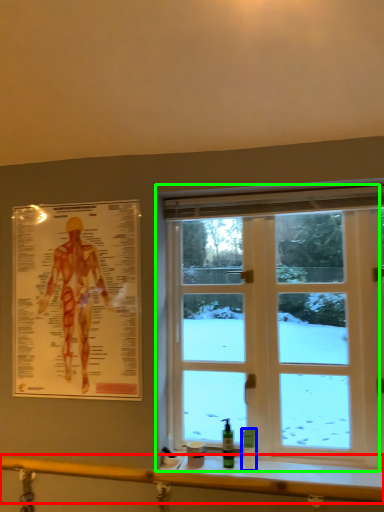
Question: Which is nearer to the rail (highlighted by a red box)? toiletry (highlighted by a blue box) or window (highlighted by a green box).

Choices:
 (A) toiletry
 (B) window

Answer: (A)